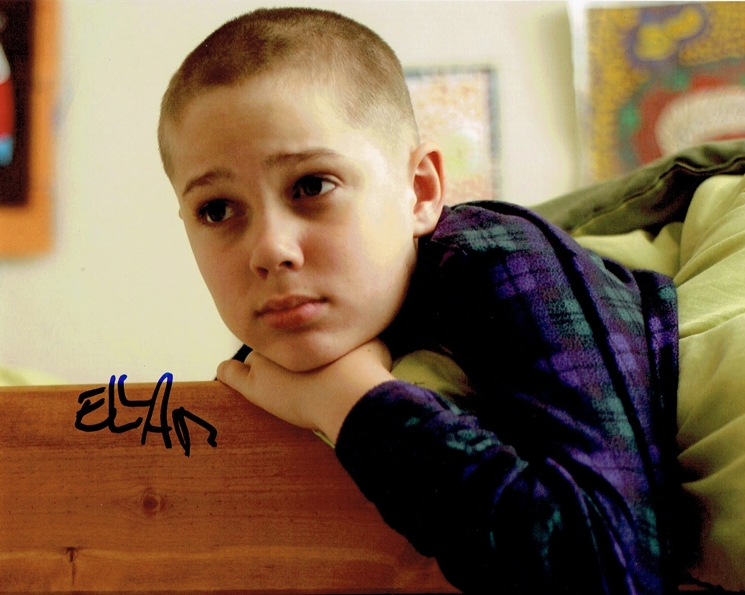
You are a GUI agent. You are given a task and a screenshot of the screen. Output one action in this format:
    pyautogui.click(x=<x>, y=<y>)
    Task: Click on the brown frame
    The image size is (745, 595).
    Given the screenshot: What is the action you would take?
    pyautogui.click(x=50, y=120)